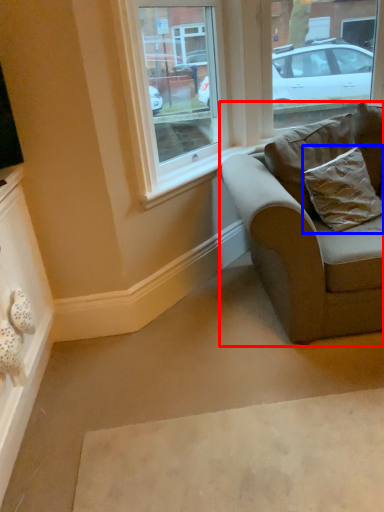
Question: Which object appears closest to the camera in this image, studio couch (highlighted by a red box) or pillow (highlighted by a blue box)?

Choices:
 (A) studio couch
 (B) pillow

Answer: (A)